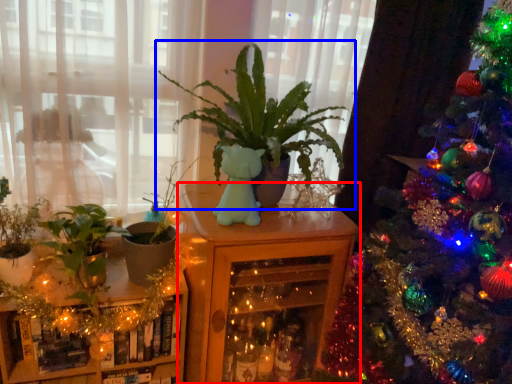
Question: Which object appears farthest to the camera in this image, furniture (highlighted by a red box) or houseplant (highlighted by a blue box)?

Choices:
 (A) furniture
 (B) houseplant

Answer: (A)